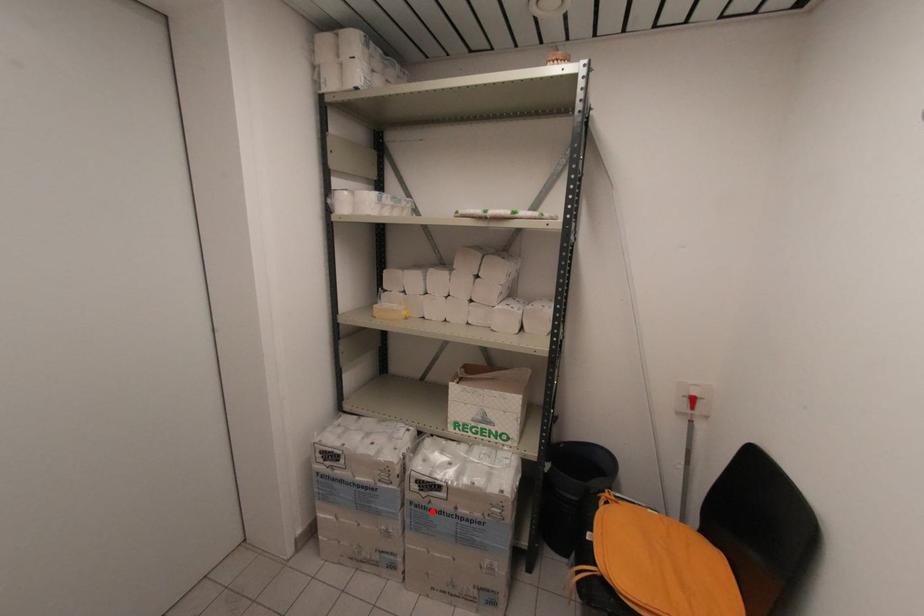
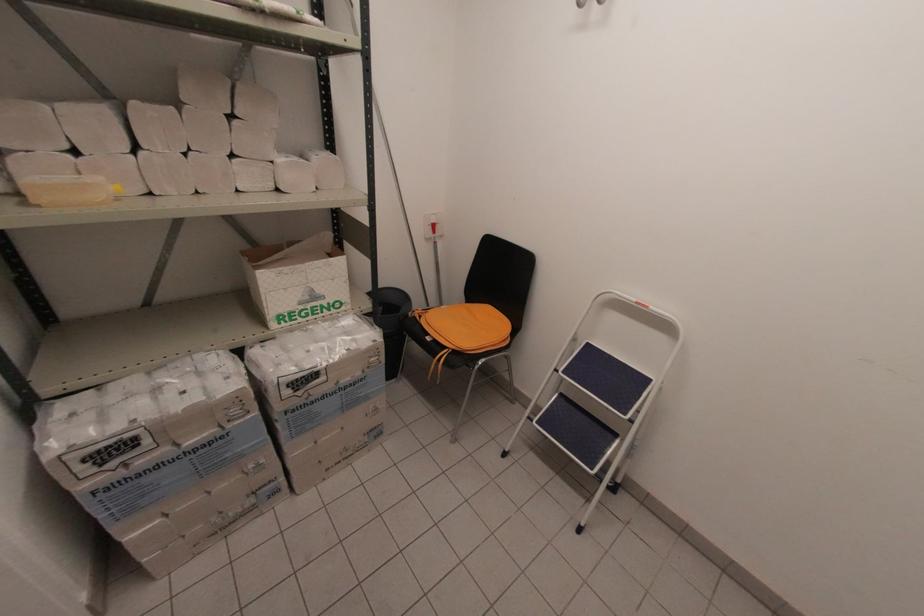
In the second image, find the point that corresponds to the highlighted location in the first image.

(312, 403)